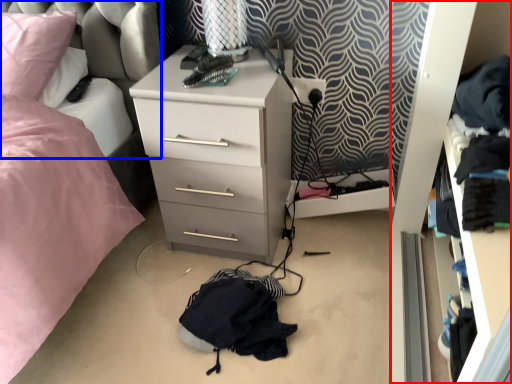
Question: Which point is further to the camera, dresser (highlighted by a red box) or swivel chair (highlighted by a blue box)?

Choices:
 (A) dresser
 (B) swivel chair

Answer: (B)